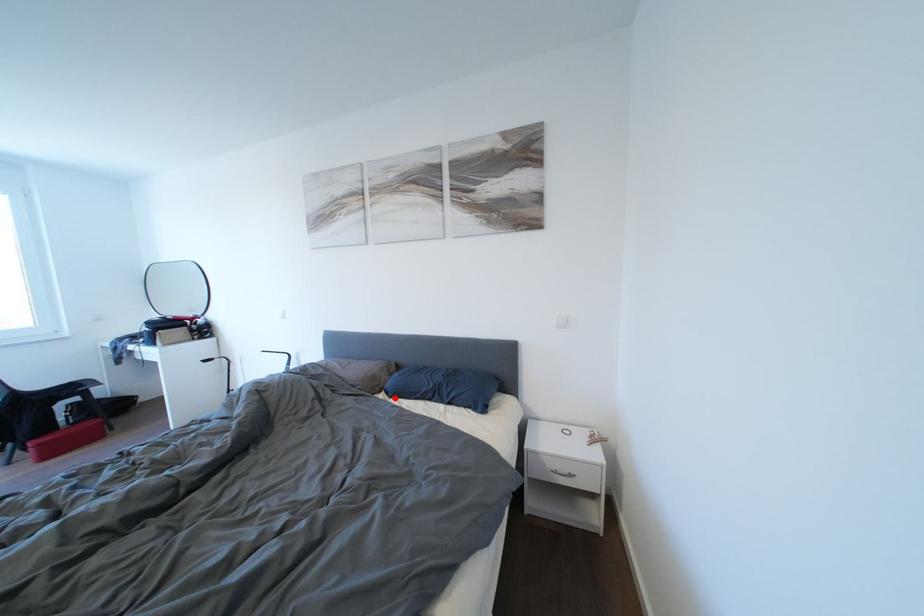
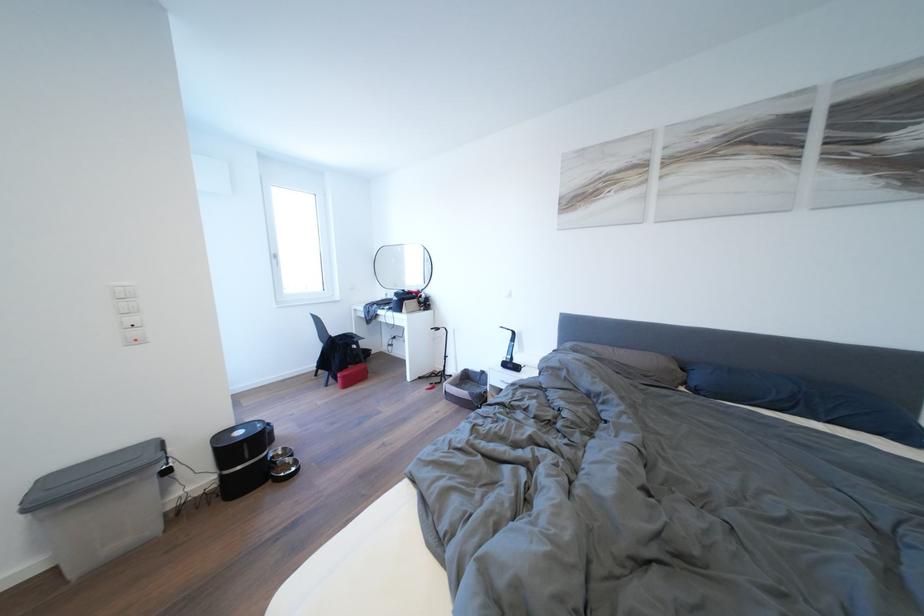
In the second image, find the point that corresponds to the highlighted location in the first image.

(703, 395)